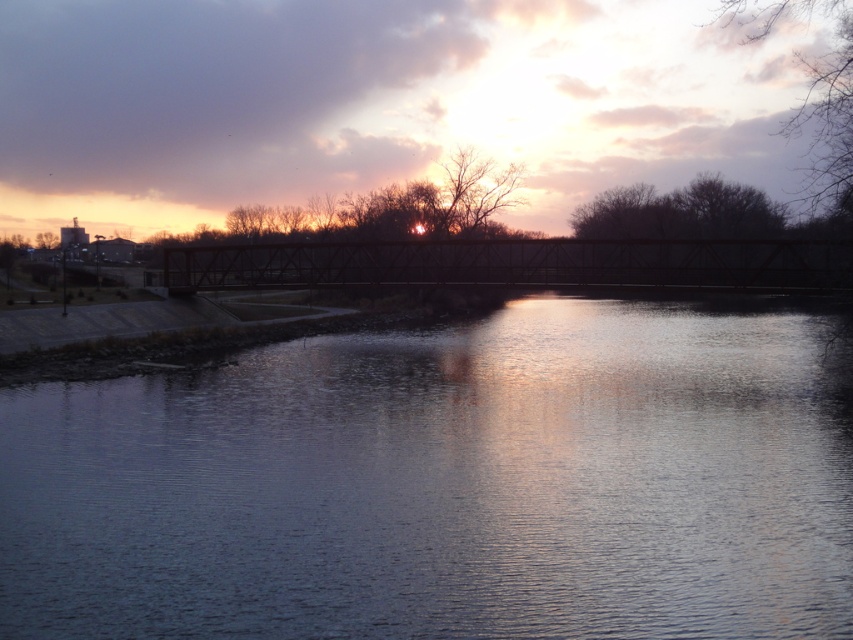
You are a photographer wanting to capture the sunset reflection on the water. You have a camera with a 30cm wide lens. The smooth water at center and dark brown metal bridge at center are both in your view. Can your lens accommodate both objects side by side?

The smooth water at center is wider than the dark brown metal bridge at center. Since the lens is 30cm wide, if the bridge is narrower than 30cm, the water being wider might still fit. However, without exact measurements, it depends on their actual sizes in the scene.

You are standing at the edge of the scene and want to find the smooth water at center. Based on the coordinates provided, in which direction should you look relative to your position?

The smooth water at center is located at coordinates point (448,483). Since you are at the edge, you should look towards the center of the image where the water is positioned.